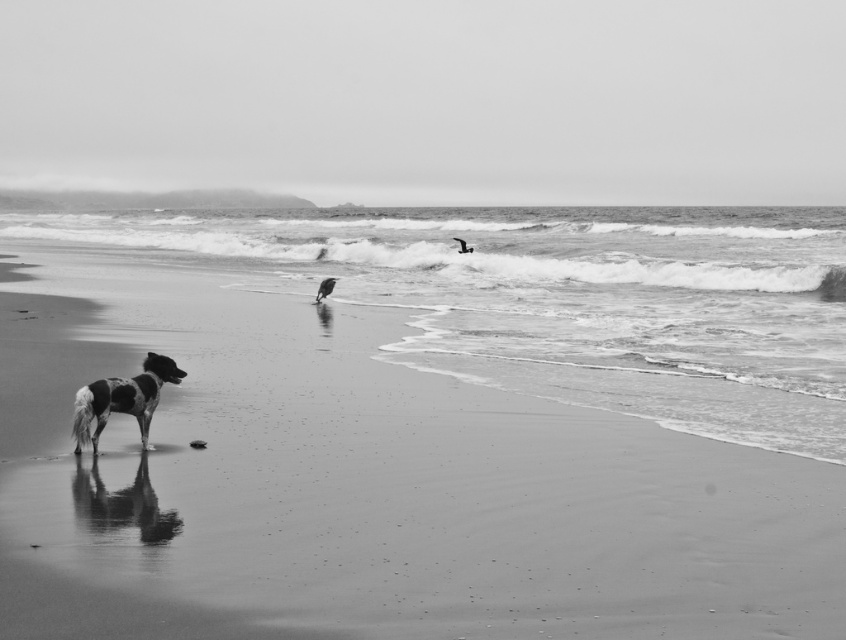
Question: Is spotted fur dog at lower left to the left of smooth feather at upper center from the viewer's perspective?

Choices:
 (A) no
 (B) yes

Answer: (B)

Question: Can you confirm if spotted fur dog at lower left is bigger than smooth feathered bird at center?

Choices:
 (A) yes
 (B) no

Answer: (A)

Question: Which point appears closest to the camera in this image?

Choices:
 (A) (319, 301)
 (B) (202, 369)

Answer: (B)

Question: Is smooth sand at lower left below smooth feather at upper center?

Choices:
 (A) no
 (B) yes

Answer: (B)

Question: Which point is farther to the camera?

Choices:
 (A) smooth feather at upper center
 (B) smooth feathered bird at center
 (C) spotted fur dog at lower left
 (D) smooth sand at lower left

Answer: (A)

Question: Which object is closer to the camera taking this photo?

Choices:
 (A) smooth sand at lower left
 (B) spotted fur dog at lower left
 (C) smooth feather at upper center
 (D) smooth feathered bird at center

Answer: (A)